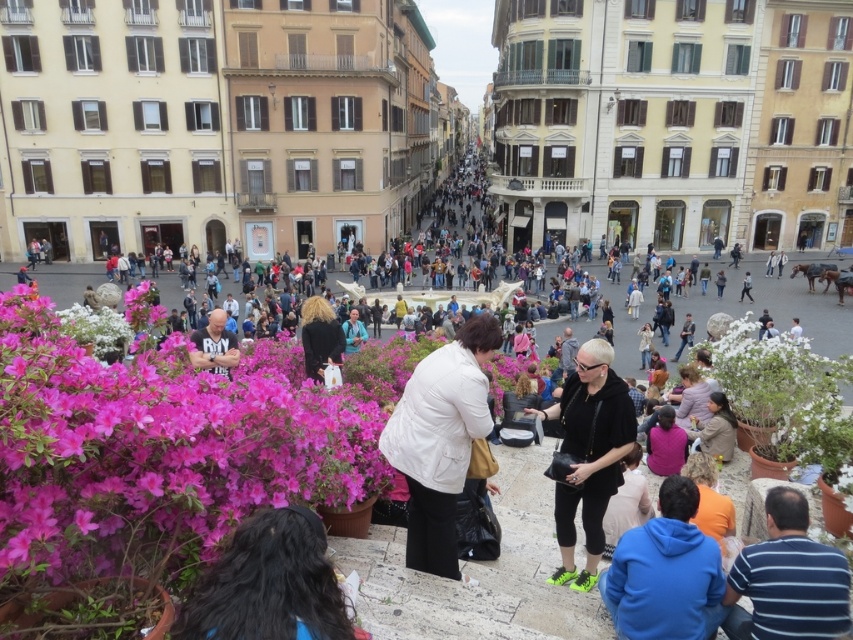
You are a photographer standing in the urban scene. You want to take a photo of the dark brown hair at lower center and the black fabric jacket at center. Which object should you focus on first to ensure both are in focus?

You should focus on the dark brown hair at lower center first because it is closer to the viewer than the black fabric jacket at center.

You are a photographer standing in the urban scene. You want to capture a photo that includes both the dark brown hair at lower center and the black fabric jacket at center. Which object should you focus on first to ensure both are in frame?

The dark brown hair at lower center should be focused on first because it occupies less space than the black fabric jacket at center, so adjusting the frame to include the smaller object first ensures there is enough space for the larger one.